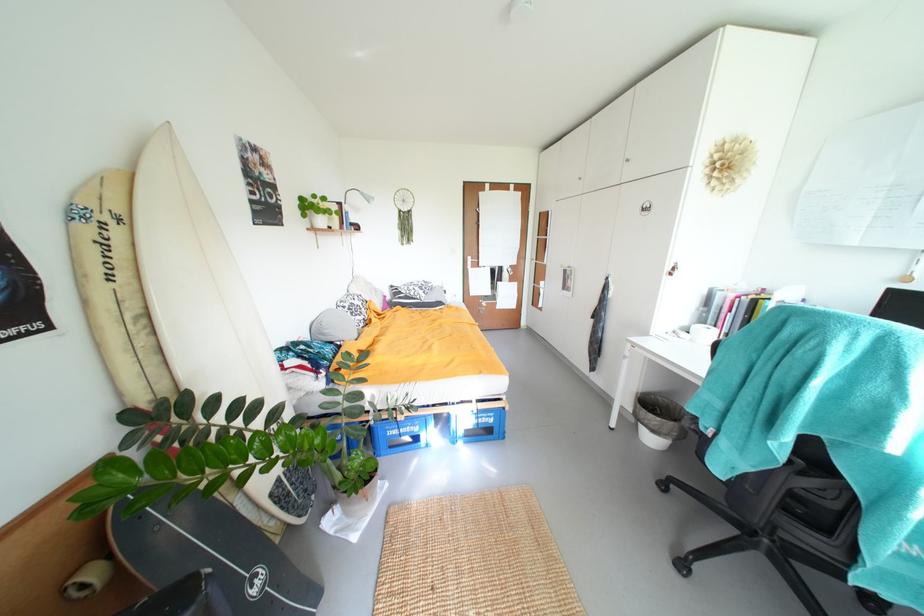
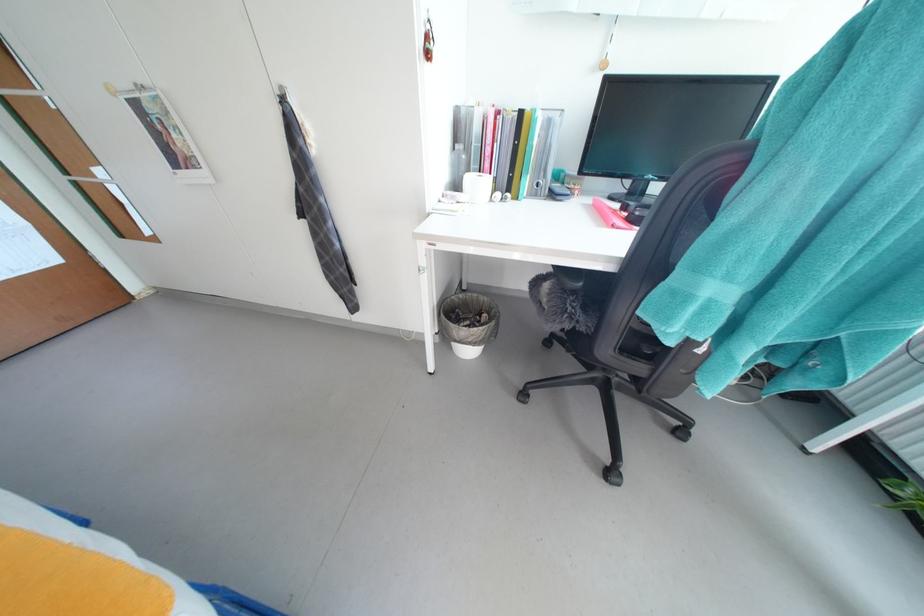
In the second image, find the point that corresponds to point (653, 424) in the first image.

(478, 342)